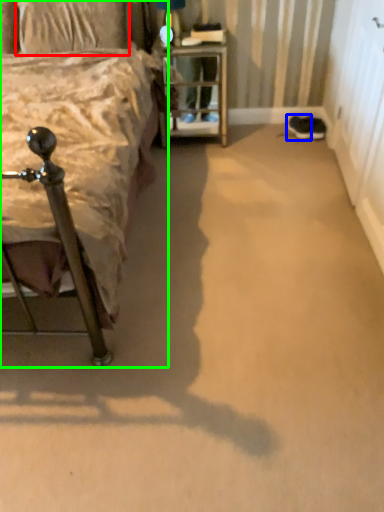
Question: Which is nearer to the pillow (highlighted by a red box)? footwear (highlighted by a blue box) or bed (highlighted by a green box).

Choices:
 (A) footwear
 (B) bed

Answer: (B)